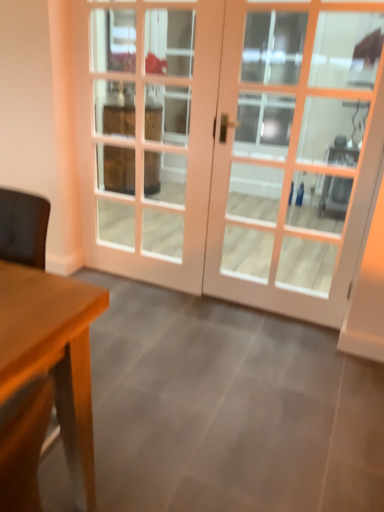
Image resolution: width=384 pixels, height=512 pixels. What do you see at coordinates (242, 151) in the screenshot?
I see `white wooden door at center` at bounding box center [242, 151].

Where is `white wooden door at center`? The height and width of the screenshot is (512, 384). white wooden door at center is located at coordinates [242, 151].

The width and height of the screenshot is (384, 512). In order to click on white glass screen door at center in this screenshot , I will do `click(154, 136)`.

What do you see at coordinates (154, 136) in the screenshot? This screenshot has width=384, height=512. I see `white glass screen door at center` at bounding box center [154, 136].

What is the approximate width of white glass screen door at center?

white glass screen door at center is 2.44 inches wide.

At what (x,y) coordinates should I click in order to perform the action: click on white wooden door at center. Please return your answer as a coordinate pair (x, y). This screenshot has width=384, height=512. Looking at the image, I should click on (242, 151).

Between white glass screen door at center and white wooden door at center, which one appears on the left side from the viewer's perspective?

white glass screen door at center is more to the left.

Between white glass screen door at center and white wooden door at center, which one is positioned behind?

white glass screen door at center is behind.

Is point (113, 148) closer to camera compared to point (156, 276)?

No, it is not.

From the image's perspective, which one is positioned higher, white glass screen door at center or white wooden door at center?

white glass screen door at center appears higher in the image.

From a real-world perspective, which object rests below the other?

white glass screen door at center, from a real-world perspective.

Between white glass screen door at center and white wooden door at center, which one has larger width?

white wooden door at center is wider.

Who is taller, white glass screen door at center or white wooden door at center?

Standing taller between the two is white glass screen door at center.

Does white glass screen door at center have a larger size compared to white wooden door at center?

Incorrect, white glass screen door at center is not larger than white wooden door at center.

Choose the correct answer: Is white glass screen door at center inside white wooden door at center or outside it?

white glass screen door at center lies within the bounds of white wooden door at center.

Can you see white glass screen door at center touching white wooden door at center?

No, white glass screen door at center is not touching white wooden door at center.

Consider the image. Could you tell me if white glass screen door at center is turned towards white wooden door at center?

Yes, white glass screen door at center is oriented towards white wooden door at center.

How many degrees apart are the facing directions of white glass screen door at center and white wooden door at center?

The angular difference between white glass screen door at center and white wooden door at center is 0.00347 degrees.

Identify the location of door lying on the right of white glass screen door at center. (242, 151).

Considering the positions of objects white wooden door at center and white glass screen door at center in the image provided, who is more to the right, white wooden door at center or white glass screen door at center?

From the viewer's perspective, white wooden door at center appears more on the right side.

In the image, is white wooden door at center positioned in front of or behind white glass screen door at center?

In the image, white wooden door at center appears in front of white glass screen door at center.

Considering the positions of points (284, 102) and (202, 35), is point (284, 102) farther from camera compared to point (202, 35)?

That is True.

From the image's perspective, is white wooden door at center positioned above or below white glass screen door at center?

Based on their image positions, white wooden door at center is located beneath white glass screen door at center.

From a real-world perspective, between white wooden door at center and white glass screen door at center, who is vertically lower?

In real-world perspective, white glass screen door at center is lower.

Can you confirm if white wooden door at center is wider than white glass screen door at center?

Yes.

Between white wooden door at center and white glass screen door at center, which one has more height?

white glass screen door at center.

Does white wooden door at center have a larger size compared to white glass screen door at center?

Correct, white wooden door at center is larger in size than white glass screen door at center.

Is white wooden door at center spatially inside white glass screen door at center, or outside of it?

white wooden door at center is spatially situated outside white glass screen door at center.

Is white wooden door at center not close to white glass screen door at center?

Yes, white wooden door at center and white glass screen door at center are quite far apart.

Is white wooden door at center turned away from white glass screen door at center?

Yes, white wooden door at center's orientation is away from white glass screen door at center.

How different are the orientations of white wooden door at center and white glass screen door at center in degrees?

0.00347 degrees separate the facing orientations of white wooden door at center and white glass screen door at center.

Measure the distance between white wooden door at center and white glass screen door at center.

white wooden door at center and white glass screen door at center are 5.99 feet apart from each other.

You are a GUI agent. You are given a task and a screenshot of the screen. Output one action in this format:
    pyautogui.click(x=<x>, y=<y>)
    Task: Click on the screen door above the white wooden door at center (from the image's perspective)
    
    Given the screenshot: What is the action you would take?
    pyautogui.click(x=154, y=136)

Identify the location of screen door below the white wooden door at center (from a real-world perspective). (154, 136).

You are a GUI agent. You are given a task and a screenshot of the screen. Output one action in this format:
    pyautogui.click(x=<x>, y=<y>)
    Task: Click on the door located on the right of white glass screen door at center
    The image size is (384, 512).
    Given the screenshot: What is the action you would take?
    pyautogui.click(x=242, y=151)